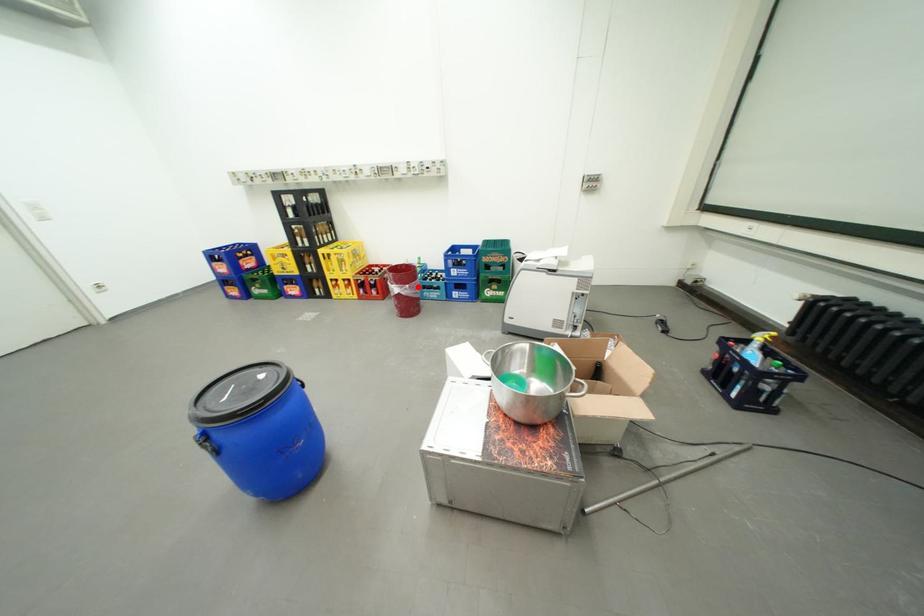
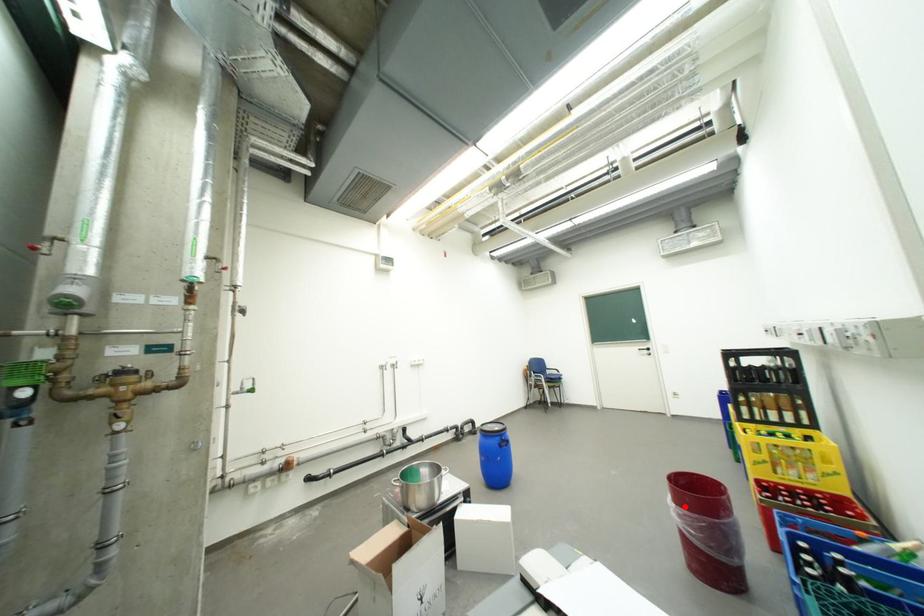
I am providing you with two images of the same scene from different viewpoints. A red point is marked on the first image and another point is marked on the second image. Does the point marked in image1 correspond to the same location as the one in image2?

Yes